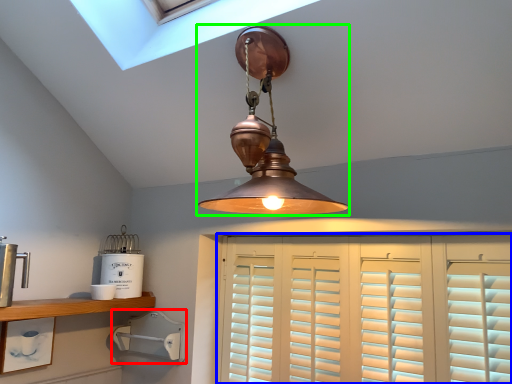
Question: Based on their relative distances, which object is nearer to appliance (highlighted by a red box)? Choose from cabinetry (highlighted by a blue box) and lamp (highlighted by a green box).

Choices:
 (A) cabinetry
 (B) lamp

Answer: (A)